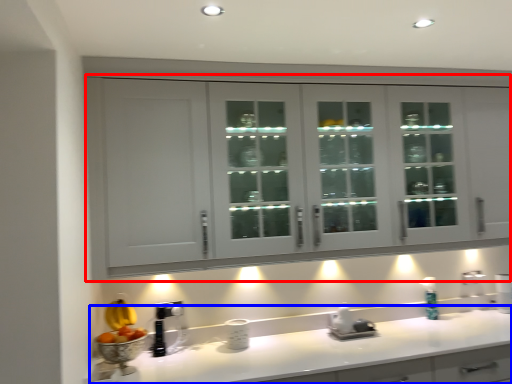
Question: Among these objects, which one is farthest to the camera, cabinetry (highlighted by a red box) or countertop (highlighted by a blue box)?

Choices:
 (A) cabinetry
 (B) countertop

Answer: (A)